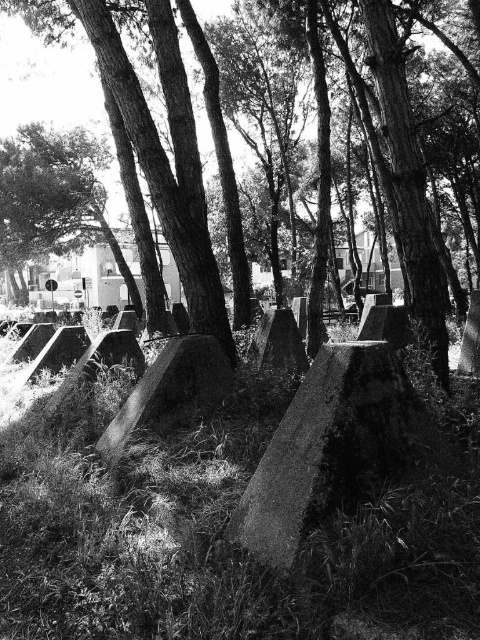
Does smooth bark tree at center lie behind smooth stone boulder at center?

Yes, it is behind smooth stone boulder at center.

Who is taller, smooth bark tree at center or smooth stone boulder at center?

smooth bark tree at center

The width and height of the screenshot is (480, 640). I want to click on smooth bark tree at center, so click(x=407, y=177).